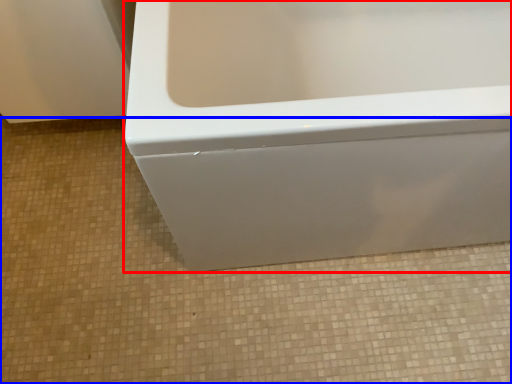
Question: Which object appears closest to the camera in this image, bathtub (highlighted by a red box) or ceramic tile (highlighted by a blue box)?

Choices:
 (A) bathtub
 (B) ceramic tile

Answer: (A)